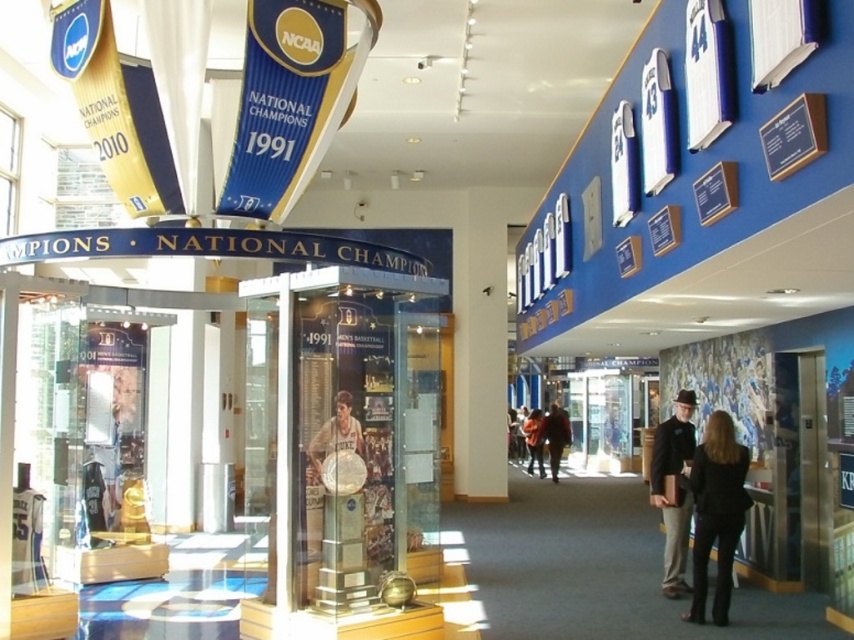
Is point (560, 417) in front of point (535, 452)?

Yes, it is in front of point (535, 452).

The image size is (854, 640). In order to click on dark brown leather jacket at center in this screenshot , I will do `click(554, 436)`.

Does black leather jacket at lower right appear under black leather jacket at center?

No.

Is point (740, 476) closer to viewer compared to point (664, 422)?

Yes, it is.

Identify the location of black leather jacket at lower right. This screenshot has height=640, width=854. (717, 513).

Between black leather jacket at lower right and dark brown leather jacket at center, which one appears on the left side from the viewer's perspective?

Positioned to the left is black leather jacket at lower right.

Is point (694, 547) in front of point (550, 442)?

That is True.

Describe the element at coordinates (717, 513) in the screenshot. I see `black leather jacket at lower right` at that location.

This screenshot has width=854, height=640. I want to click on black leather jacket at lower right, so click(x=717, y=513).